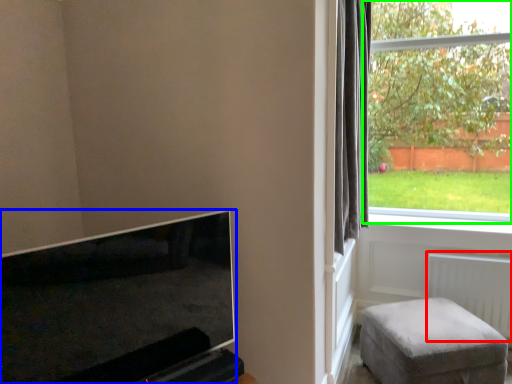
Question: Which object is positioned closest to radiator (highlighted by a red box)? Select from television (highlighted by a blue box) and window (highlighted by a green box).

Choices:
 (A) television
 (B) window

Answer: (A)